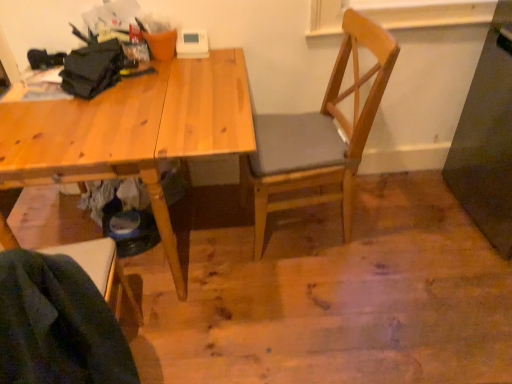
Where is `wooden chair at lower left, which is the 2th chair in back-to-front order`? wooden chair at lower left, which is the 2th chair in back-to-front order is located at coordinates (103, 272).

This screenshot has height=384, width=512. In order to click on wooden chair at center, arranged as the 1th chair when viewed from the back in this screenshot , I will do `click(320, 134)`.

Considering the sizes of objects wooden chair at center, acting as the 2th chair starting from the left, and natural wood desk at upper left in the image provided, who is wider, wooden chair at center, acting as the 2th chair starting from the left, or natural wood desk at upper left?

With larger width is natural wood desk at upper left.

Does wooden chair at center, placed as the 1th chair when sorted from right to left, come in front of natural wood desk at upper left?

No, the depth of wooden chair at center, placed as the 1th chair when sorted from right to left, is greater than that of natural wood desk at upper left.

From the picture: Is wooden chair at center, the 2th chair from the front, positioned far away from natural wood desk at upper left?

wooden chair at center, the 2th chair from the front, is actually quite close to natural wood desk at upper left.

From the image's perspective, between wooden chair at center, acting as the 2th chair starting from the left, and natural wood desk at upper left, who is located below?

natural wood desk at upper left.

Would you say natural wood desk at upper left is inside or outside wooden chair at center, acting as the 2th chair starting from the left?

natural wood desk at upper left is located beyond the bounds of wooden chair at center, acting as the 2th chair starting from the left.

Looking at this image, how distant is natural wood desk at upper left from wooden chair at center, acting as the 2th chair starting from the left?

natural wood desk at upper left is 17.66 inches away from wooden chair at center, acting as the 2th chair starting from the left.

Does natural wood desk at upper left have a greater height compared to wooden chair at center, arranged as the 1th chair when viewed from the back?

In fact, natural wood desk at upper left may be shorter than wooden chair at center, arranged as the 1th chair when viewed from the back.

From the image's perspective, between natural wood desk at upper left and wooden chair at center, arranged as the 1th chair when viewed from the back, which one is located above?

wooden chair at center, arranged as the 1th chair when viewed from the back, appears higher in the image.

In the image, there is a wooden chair at lower left, acting as the second chair starting from the right. At what (x,y) coordinates should I click in order to perform the action: click on chair above it (from the image's perspective). Please return your answer as a coordinate pair (x, y). Looking at the image, I should click on (320, 134).

Relative to wooden chair at center, placed as the 1th chair when sorted from right to left, is wooden chair at lower left, the first chair positioned from the left, in front or behind?

In the image, wooden chair at lower left, the first chair positioned from the left, appears in front of wooden chair at center, placed as the 1th chair when sorted from right to left.

Considering the relative positions of wooden chair at lower left, the first chair positioned from the left, and wooden chair at center, placed as the 1th chair when sorted from right to left, in the image provided, is wooden chair at lower left, the first chair positioned from the left, to the right of wooden chair at center, placed as the 1th chair when sorted from right to left, from the viewer's perspective?

No.

Considering the relative sizes of natural wood desk at upper left and wooden chair at lower left, acting as the second chair starting from the right, in the image provided, is natural wood desk at upper left smaller than wooden chair at lower left, acting as the second chair starting from the right,?

Actually, natural wood desk at upper left might be larger than wooden chair at lower left, acting as the second chair starting from the right.

How many degrees apart are the facing directions of natural wood desk at upper left and wooden chair at lower left, which is the 2th chair in back-to-front order?

173 degrees separate the facing orientations of natural wood desk at upper left and wooden chair at lower left, which is the 2th chair in back-to-front order.

Which is correct: natural wood desk at upper left is inside wooden chair at lower left, the first chair in the front-to-back sequence, or outside of it?

natural wood desk at upper left is not inside wooden chair at lower left, the first chair in the front-to-back sequence, it's outside.

At what (x,y) coordinates should I click in order to perform the action: click on desk on the right of wooden chair at lower left, acting as the second chair starting from the right. Please return your answer as a coordinate pair (x, y). This screenshot has width=512, height=384. Looking at the image, I should click on (133, 131).

Could you tell me if wooden chair at lower left, the first chair positioned from the left, is turned towards natural wood desk at upper left?

Yes, wooden chair at lower left, the first chair positioned from the left, is turned towards natural wood desk at upper left.

Does wooden chair at lower left, the first chair positioned from the left, come in front of natural wood desk at upper left?

Yes, wooden chair at lower left, the first chair positioned from the left, is closer to the viewer.

Consider the image. Could natural wood desk at upper left be considered to be inside wooden chair at lower left, which is the 2th chair in back-to-front order?

No, natural wood desk at upper left is located outside of wooden chair at lower left, which is the 2th chair in back-to-front order.

Considering the relative sizes of wooden chair at center, placed as the 1th chair when sorted from right to left, and wooden chair at lower left, the first chair in the front-to-back sequence, in the image provided, is wooden chair at center, placed as the 1th chair when sorted from right to left, shorter than wooden chair at lower left, the first chair in the front-to-back sequence,?

In fact, wooden chair at center, placed as the 1th chair when sorted from right to left, may be taller than wooden chair at lower left, the first chair in the front-to-back sequence.

From the image's perspective, between wooden chair at center, acting as the 2th chair starting from the left, and wooden chair at lower left, the first chair in the front-to-back sequence, which one is located above?

wooden chair at center, acting as the 2th chair starting from the left.

Is wooden chair at center, acting as the 2th chair starting from the left, not inside wooden chair at lower left, which is the 2th chair in back-to-front order?

Absolutely, wooden chair at center, acting as the 2th chair starting from the left, is external to wooden chair at lower left, which is the 2th chair in back-to-front order.

From a real-world perspective, count 1st chairs upward from the natural wood desk at upper left and point to it. Please provide its 2D coordinates.

[(320, 134)]

Identify the location of desk that is below the wooden chair at center, acting as the 2th chair starting from the left (from the image's perspective). (133, 131).

Based on their spatial positions, is wooden chair at center, acting as the 2th chair starting from the left, or wooden chair at lower left, acting as the second chair starting from the right, closer to natural wood desk at upper left?

Among the two, wooden chair at lower left, acting as the second chair starting from the right, is located nearer to natural wood desk at upper left.

In the scene shown: Estimate the real-world distances between objects in this image. Which object is further from wooden chair at center, arranged as the 1th chair when viewed from the back, natural wood desk at upper left or wooden chair at lower left, which is the 2th chair in back-to-front order?

The object further to wooden chair at center, arranged as the 1th chair when viewed from the back, is wooden chair at lower left, which is the 2th chair in back-to-front order.

From the image, which object appears to be farther from natural wood desk at upper left, wooden chair at lower left, acting as the second chair starting from the right, or wooden chair at center, placed as the 1th chair when sorted from right to left?

wooden chair at center, placed as the 1th chair when sorted from right to left.

Consider the image. Based on their spatial positions, is wooden chair at center, the 2th chair from the front, or natural wood desk at upper left closer to wooden chair at lower left, the first chair positioned from the left?

natural wood desk at upper left lies closer to wooden chair at lower left, the first chair positioned from the left, than the other object.

Looking at the image, which one is located further to wooden chair at lower left, which is the 2th chair in back-to-front order, natural wood desk at upper left or wooden chair at center, the 2th chair from the front?

The object further to wooden chair at lower left, which is the 2th chair in back-to-front order, is wooden chair at center, the 2th chair from the front.

Estimate the real-world distances between objects in this image. Which object is further from wooden chair at center, placed as the 1th chair when sorted from right to left, wooden chair at lower left, acting as the second chair starting from the right, or natural wood desk at upper left?

The object further to wooden chair at center, placed as the 1th chair when sorted from right to left, is wooden chair at lower left, acting as the second chair starting from the right.

Where is `desk between wooden chair at lower left, the first chair in the front-to-back sequence, and wooden chair at center, acting as the 2th chair starting from the left, from left to right`? This screenshot has height=384, width=512. desk between wooden chair at lower left, the first chair in the front-to-back sequence, and wooden chair at center, acting as the 2th chair starting from the left, from left to right is located at coordinates (133, 131).